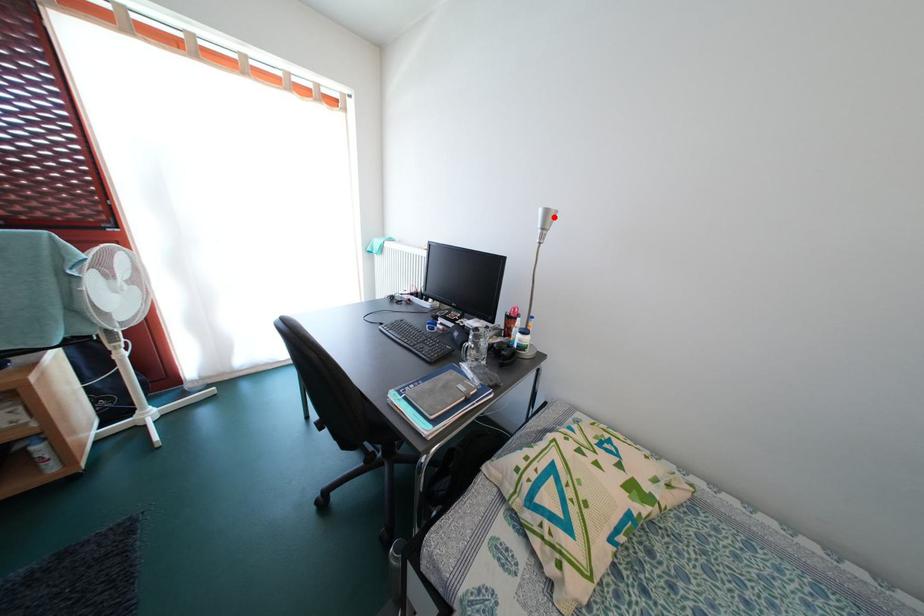
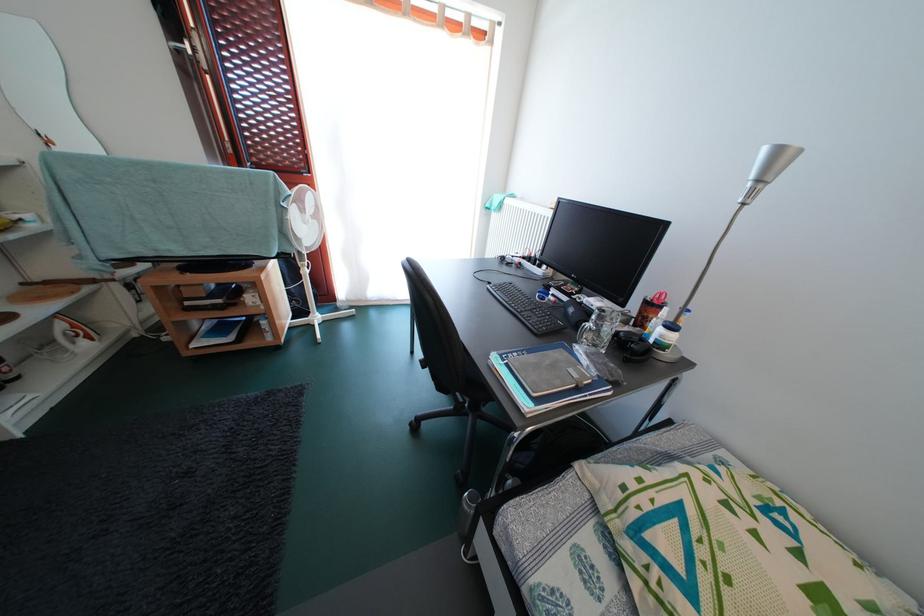
Question: I am providing you with two images of the same scene from different viewpoints. A red point is marked on the first image. Can you still see the location of the red point in image 2?

Choices:
 (A) Yes
 (B) No

Answer: (A)